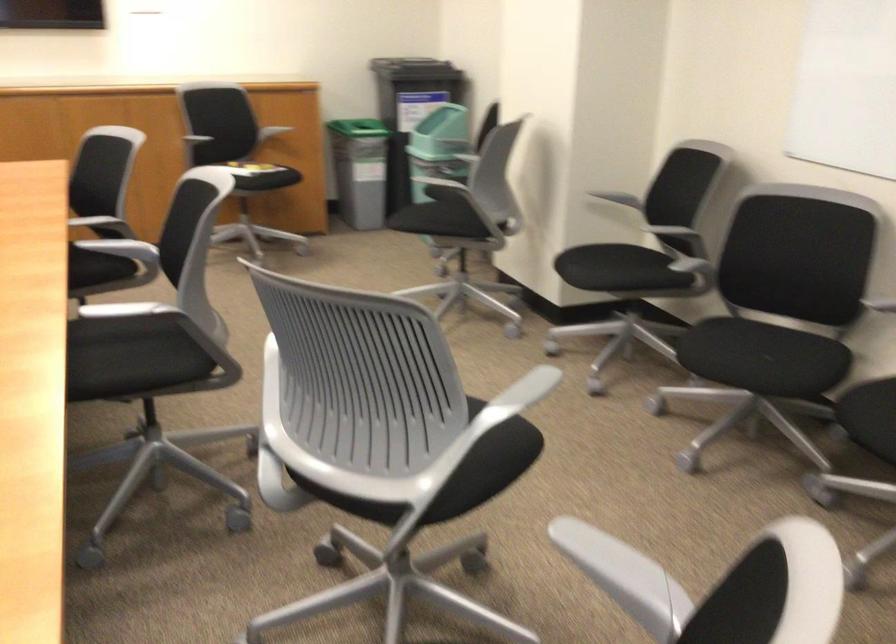
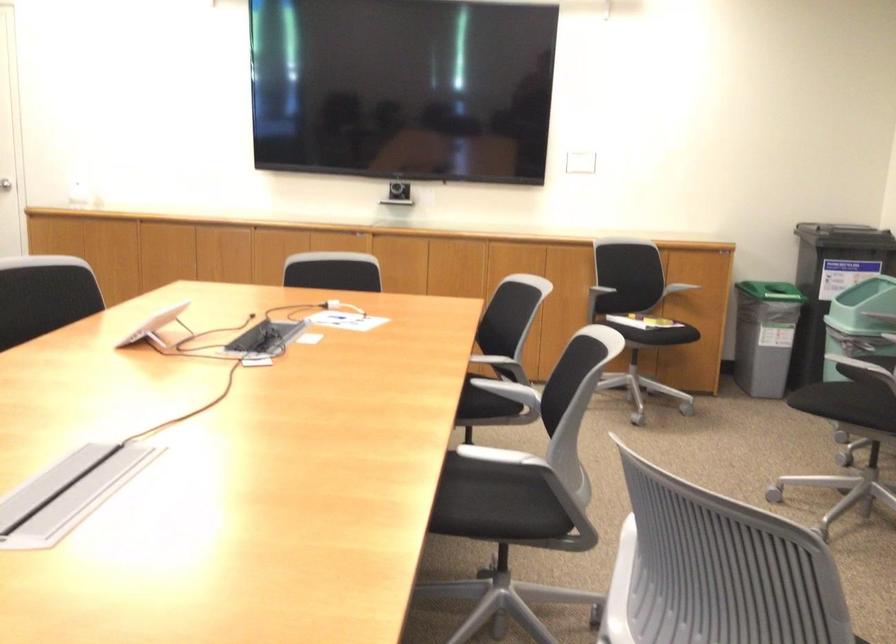
The point at (x=122, y=225) is marked in the first image. Where is the corresponding point in the second image?

(505, 366)